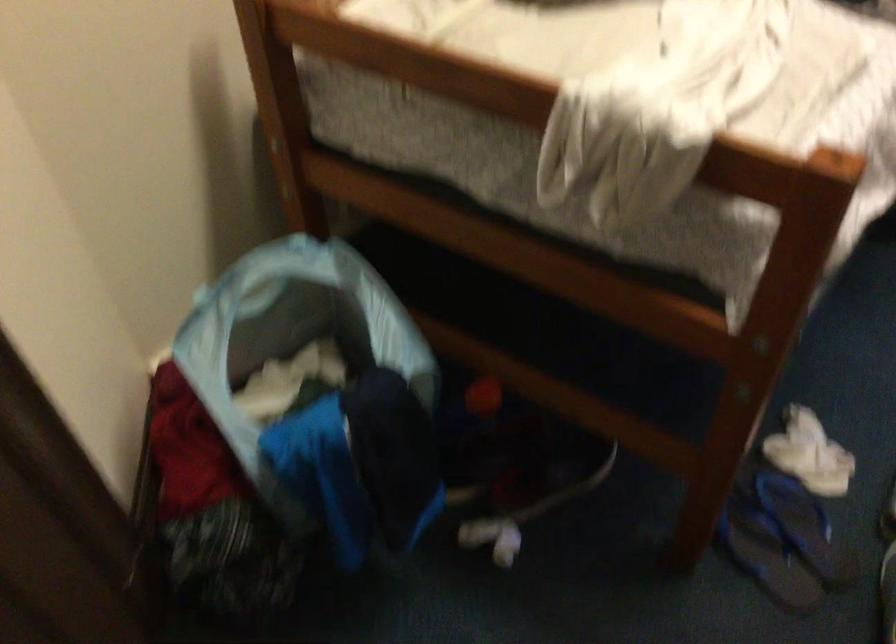
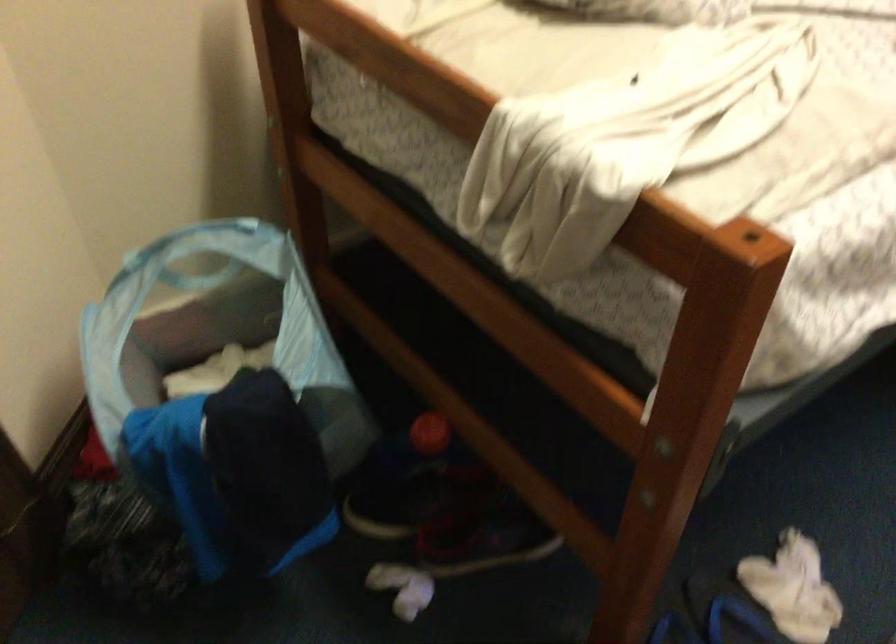
The images are taken continuously from a first-person perspective. In which direction are you moving?

The cameraman moved toward right, forward.